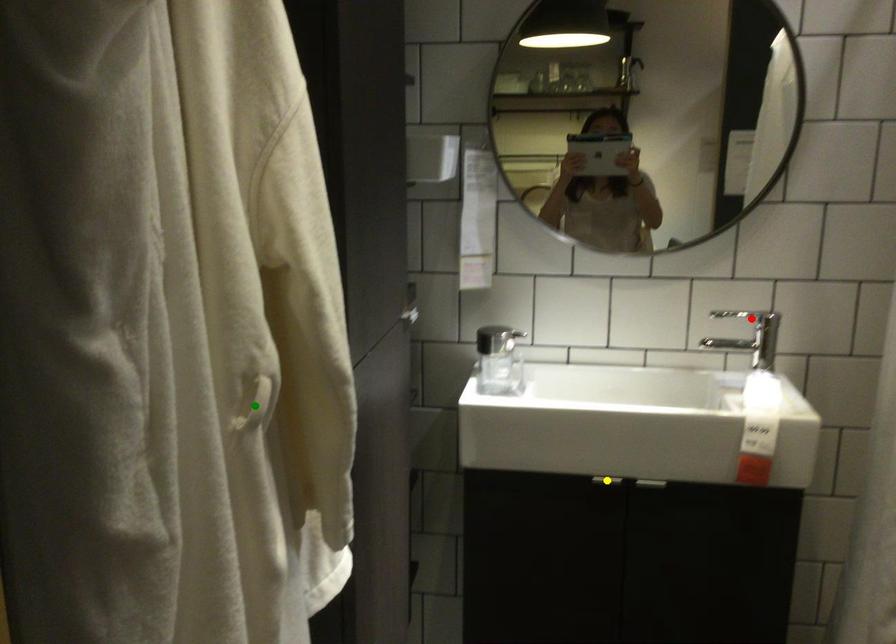
Order these from farthest to nearest:
green point | red point | yellow point

red point → yellow point → green point